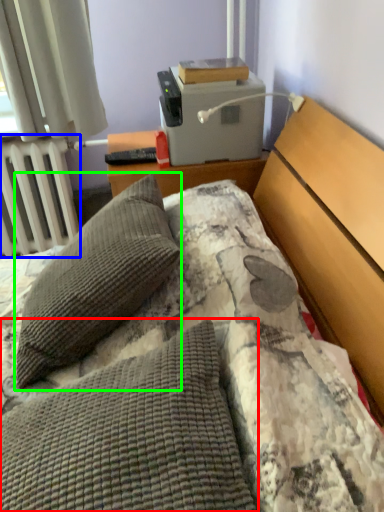
Question: Estimate the real-world distances between objects in this image. Which object is closer to pillow (highlighted by a red box), radiator (highlighted by a blue box) or pillow (highlighted by a green box)?

Choices:
 (A) radiator
 (B) pillow

Answer: (B)